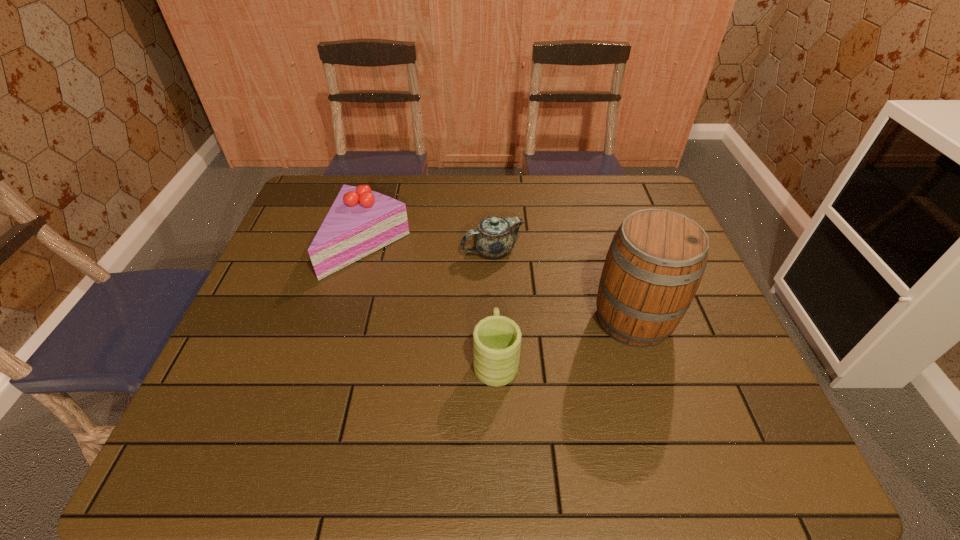
The image size is (960, 540). In order to click on vacant area at the right edge of the desktop in this screenshot , I will do `click(711, 347)`.

Where is `free spot at the far left corner of the desktop`? free spot at the far left corner of the desktop is located at coordinates (305, 198).

The image size is (960, 540). Find the location of `free space at the near left corner`. free space at the near left corner is located at coordinates (209, 431).

At what (x,y) coordinates should I click in order to perform the action: click on blank region between the third shortest object and the chinaware. Please return your answer as a coordinate pair (x, y). Looking at the image, I should click on [431, 248].

Locate an element on the screen. The width and height of the screenshot is (960, 540). empty space that is in between the mug and the cake is located at coordinates (432, 302).

At what (x,y) coordinates should I click in order to perform the action: click on empty space between the second tallest object and the chinaware. Please return your answer as a coordinate pair (x, y). Image resolution: width=960 pixels, height=540 pixels. Looking at the image, I should click on (431, 248).

Locate an element on the screen. The image size is (960, 540). free spot between the tallest object and the second tallest object is located at coordinates (501, 282).

Find the location of a particular element. vacant area that lies between the mug and the rightmost object is located at coordinates (564, 340).

This screenshot has width=960, height=540. In order to click on blank region between the tallest object and the mug in this screenshot , I will do `click(564, 340)`.

I want to click on free spot between the cider and the chinaware, so click(x=563, y=285).